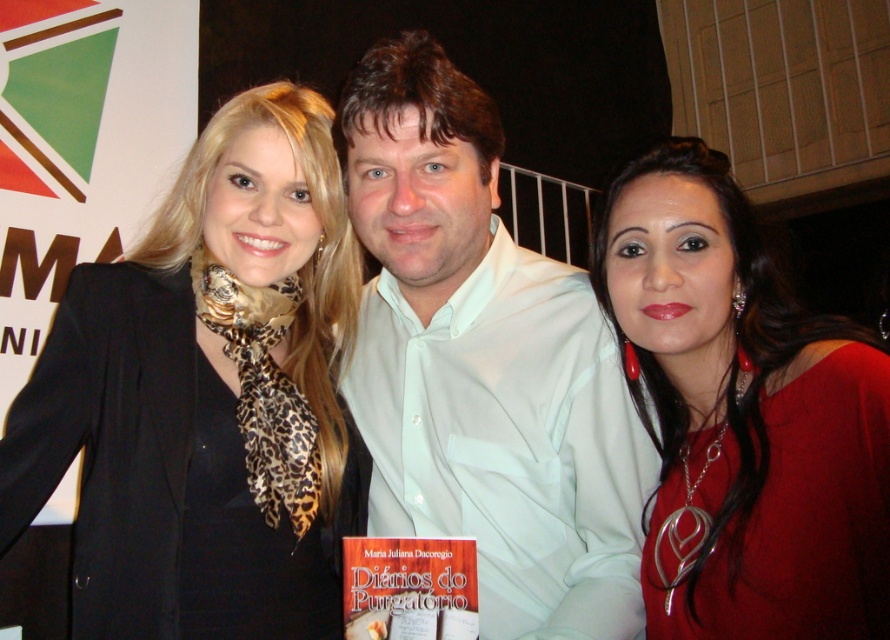
What do you see at coordinates (484, 365) in the screenshot?
I see `white cotton shirt at center` at bounding box center [484, 365].

Measure the distance between white cotton shirt at center and matte red blouse at center.

white cotton shirt at center is 7.73 inches from matte red blouse at center.

Which is in front, point (476, 257) or point (718, 573)?

Point (718, 573) is in front.

The width and height of the screenshot is (890, 640). I want to click on white cotton shirt at center, so click(x=484, y=365).

Does black leopard print scarf at center have a greater height compared to white cotton shirt at center?

No.

Between point (247, 200) and point (654, 470), which one is positioned behind?

Point (247, 200)

Does point (197, 605) come closer to viewer compared to point (531, 305)?

Yes, point (197, 605) is in front of point (531, 305).

Where is `black leopard print scarf at center`? The image size is (890, 640). black leopard print scarf at center is located at coordinates (206, 396).

Is black leopard print scarf at center closer to the viewer compared to matte red blouse at center?

No, black leopard print scarf at center is further to the viewer.

Does black leopard print scarf at center lie behind matte red blouse at center?

Yes, black leopard print scarf at center is behind matte red blouse at center.

Between point (297, 269) and point (615, 227), which one is positioned in front?

Positioned in front is point (615, 227).

I want to click on black leopard print scarf at center, so click(206, 396).